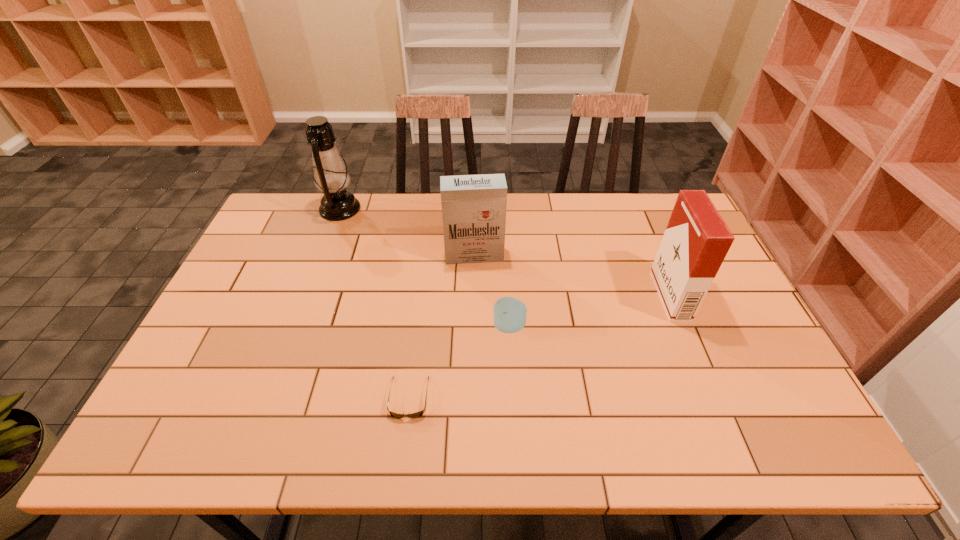
What are the coordinates of `vacant space that satisfies the following two spatial constraints: 1. on the front-facing side of the right cigarette case; 2. on the front-facing side of the second object from left to right` in the screenshot? It's located at (711, 397).